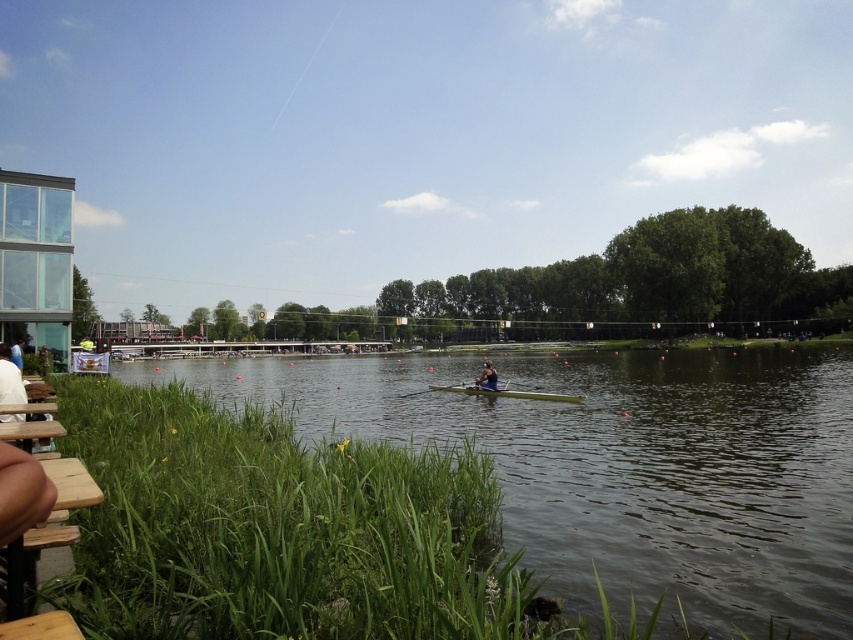
You are standing on the riverbank and want to take a photo of the green grassy river at center and the blue fabric rower at center. Which object will appear larger in your photo?

The green grassy river at center will appear larger in the photo because it is closer to the viewer than the blue fabric rower at center.

You are standing on the riverbank and see the green grassy river at center and the blue fabric rower at center. Which object is positioned more to your left?

The green grassy river at center is positioned more to the left than the blue fabric rower at center.

Based on the photo, you are standing on the riverside and see the green smooth canoe at center and the white fabric at lower left. Which object is closer to the water surface?

The green smooth canoe at center is closer to the water surface because it is below the white fabric at lower left.